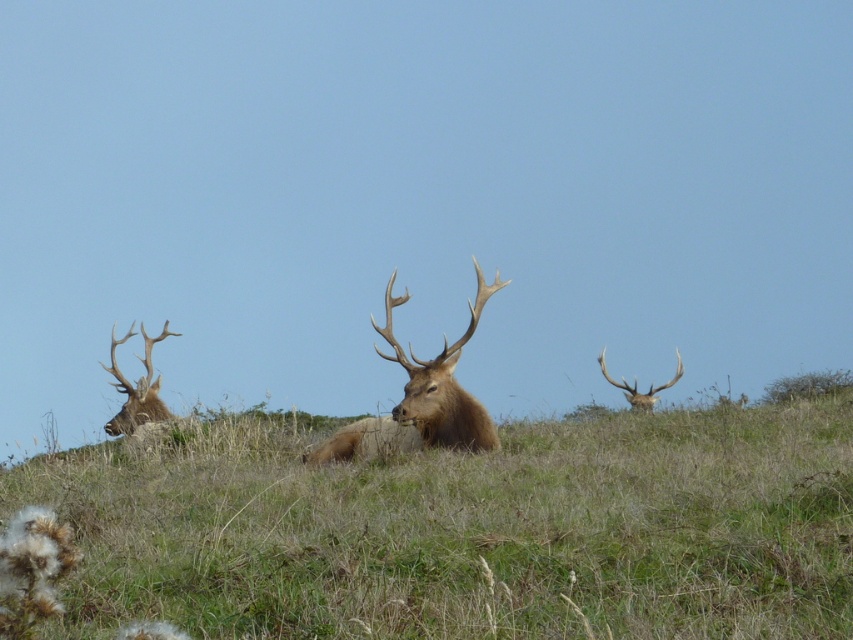
You are an ecologist observing the elk in the scene. You notice the green grass at center and the brown velvet antler at upper right. Which object is closer to you?

The green grass at center is closer to you because it is in front of the brown velvet antler at upper right.

You are standing in the field and see the green grass at center and the brown velvet antler at center. Which one is wider?

The brown velvet antler at center is wider than the green grass at center.